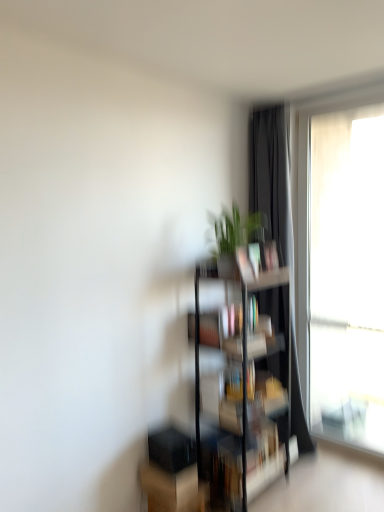
Question: Should I look upward or downward to see green matte plant at center?

Choices:
 (A) up
 (B) down

Answer: (A)

Question: Should I look upward or downward to see black matte curtain at right?

Choices:
 (A) up
 (B) down

Answer: (B)

Question: From the image's perspective, is clear glass bookshelf at center under green matte plant at center?

Choices:
 (A) yes
 (B) no

Answer: (A)

Question: Is clear glass bookshelf at center positioned with its back to green matte plant at center?

Choices:
 (A) yes
 (B) no

Answer: (B)

Question: Considering the relative sizes of clear glass bookshelf at center and green matte plant at center in the image provided, is clear glass bookshelf at center bigger than green matte plant at center?

Choices:
 (A) yes
 (B) no

Answer: (A)

Question: Can green matte plant at center be found inside clear glass bookshelf at center?

Choices:
 (A) yes
 (B) no

Answer: (B)

Question: Is the depth of clear glass bookshelf at center greater than that of green matte plant at center?

Choices:
 (A) yes
 (B) no

Answer: (A)

Question: Does clear glass bookshelf at center lie in front of green matte plant at center?

Choices:
 (A) no
 (B) yes

Answer: (A)

Question: Is green matte plant at center at the right side of black matte curtain at right?

Choices:
 (A) no
 (B) yes

Answer: (A)

Question: Is green matte plant at center far from black matte curtain at right?

Choices:
 (A) yes
 (B) no

Answer: (B)

Question: Is green matte plant at center taller than black matte curtain at right?

Choices:
 (A) yes
 (B) no

Answer: (B)

Question: Is green matte plant at center thinner than black matte curtain at right?

Choices:
 (A) no
 (B) yes

Answer: (B)

Question: From a real-world perspective, is green matte plant at center on black matte curtain at right?

Choices:
 (A) yes
 (B) no

Answer: (A)

Question: From the image's perspective, is green matte plant at center located above black matte curtain at right?

Choices:
 (A) no
 (B) yes

Answer: (B)

Question: Are translucent fabric at right and clear glass bookshelf at center far apart?

Choices:
 (A) yes
 (B) no

Answer: (B)